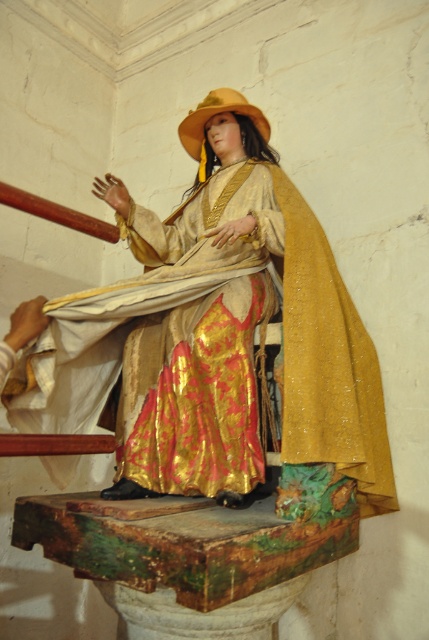
Question: Is gold shiny dress at center in front of golden textured hat at upper center?

Choices:
 (A) yes
 (B) no

Answer: (A)

Question: Can you confirm if gold shiny dress at center is positioned below golden textured hat at upper center?

Choices:
 (A) yes
 (B) no

Answer: (A)

Question: Does gold shiny dress at center appear on the left side of golden textured hat at upper center?

Choices:
 (A) no
 (B) yes

Answer: (B)

Question: Among these objects, which one is nearest to the camera?

Choices:
 (A) gold shiny dress at center
 (B) golden textured hat at upper center

Answer: (A)

Question: Which point appears farthest from the camera in this image?

Choices:
 (A) (51, 314)
 (B) (211, 97)

Answer: (B)

Question: Among these points, which one is nearest to the camera?

Choices:
 (A) (202, 118)
 (B) (311, 320)

Answer: (B)